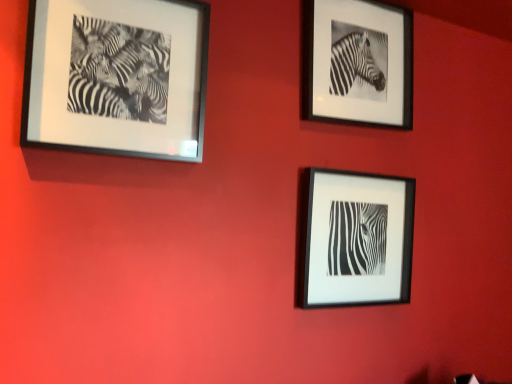
This screenshot has height=384, width=512. What are the coordinates of `black matte frame at upper right, the first picture frame from the right` in the screenshot? It's located at (357, 63).

What do you see at coordinates (355, 239) in the screenshot?
I see `black matte frame at center, which appears as the second picture frame when viewed from the right` at bounding box center [355, 239].

Find the location of a particular element. The width and height of the screenshot is (512, 384). black matte frame at upper right, the first picture frame from the right is located at coordinates (357, 63).

Can you tell me how much black matte frame at center, which appears as the second picture frame when viewed from the right, and black matte photo frame at upper left, the 3th picture frame positioned from the right, differ in facing direction?

The facing directions of black matte frame at center, which appears as the second picture frame when viewed from the right, and black matte photo frame at upper left, the 3th picture frame positioned from the right, are 0.181 degrees apart.

Is black matte frame at center, which appears as the second picture frame when viewed from the right, placed right next to black matte photo frame at upper left, which is the first picture frame from left to right?

No, black matte frame at center, which appears as the second picture frame when viewed from the right, is not next to black matte photo frame at upper left, which is the first picture frame from left to right.

Could you measure the distance between black matte frame at center, the 2th picture frame in the left-to-right sequence, and black matte photo frame at upper left, the 3th picture frame positioned from the right?

29.26 inches.

Which of these two, black matte frame at center, the 2th picture frame in the left-to-right sequence, or black matte photo frame at upper left, the 3th picture frame positioned from the right, is smaller?

black matte frame at center, the 2th picture frame in the left-to-right sequence, is smaller.

Which of these two, black matte photo frame at upper left, which is the first picture frame from left to right, or black matte frame at center, the 2th picture frame in the left-to-right sequence, is wider?

black matte photo frame at upper left, which is the first picture frame from left to right, is wider.

Is black matte photo frame at upper left, the 3th picture frame positioned from the right, closer to camera compared to black matte frame at center, which appears as the second picture frame when viewed from the right?

Yes, black matte photo frame at upper left, the 3th picture frame positioned from the right, is closer to the viewer.

Could you measure the distance between black matte photo frame at upper left, the 3th picture frame positioned from the right, and black matte frame at center, which appears as the second picture frame when viewed from the right?

black matte photo frame at upper left, the 3th picture frame positioned from the right, and black matte frame at center, which appears as the second picture frame when viewed from the right, are 74.31 centimeters apart.

Is black matte photo frame at upper left, which is the first picture frame from left to right, facing towards black matte frame at center, the 2th picture frame in the left-to-right sequence?

No, black matte photo frame at upper left, which is the first picture frame from left to right, is not oriented towards black matte frame at center, the 2th picture frame in the left-to-right sequence.

Where is `the 2nd picture frame in front of the black matte frame at upper right, which appears as the 3th picture frame when viewed from the left, counting from the anchor's position`? The width and height of the screenshot is (512, 384). the 2nd picture frame in front of the black matte frame at upper right, which appears as the 3th picture frame when viewed from the left, counting from the anchor's position is located at coordinates click(x=117, y=77).

Which is behind, black matte frame at upper right, which appears as the 3th picture frame when viewed from the left, or black matte photo frame at upper left, the 3th picture frame positioned from the right?

black matte frame at upper right, which appears as the 3th picture frame when viewed from the left, is more distant.

Between point (398, 62) and point (102, 112), which one is positioned behind?

Point (398, 62)

Looking at the image, does black matte frame at upper right, which appears as the 3th picture frame when viewed from the left, seem bigger or smaller compared to black matte photo frame at upper left, the 3th picture frame positioned from the right?

In the image, black matte frame at upper right, which appears as the 3th picture frame when viewed from the left, appears to be smaller than black matte photo frame at upper left, the 3th picture frame positioned from the right.

Does black matte frame at upper right, which appears as the 3th picture frame when viewed from the left, appear on the right side of black matte frame at center, the 2th picture frame in the left-to-right sequence?

Correct, you'll find black matte frame at upper right, which appears as the 3th picture frame when viewed from the left, to the right of black matte frame at center, the 2th picture frame in the left-to-right sequence.

Is black matte frame at upper right, which appears as the 3th picture frame when viewed from the left, wider or thinner than black matte frame at center, which appears as the second picture frame when viewed from the right?

In the image, black matte frame at upper right, which appears as the 3th picture frame when viewed from the left, appears to be more narrow than black matte frame at center, which appears as the second picture frame when viewed from the right.

Could you tell me if black matte frame at upper right, the first picture frame from the right, is facing black matte frame at center, which appears as the second picture frame when viewed from the right?

No, black matte frame at upper right, the first picture frame from the right, is not turned towards black matte frame at center, which appears as the second picture frame when viewed from the right.

From the image's perspective, between black matte frame at upper right, the first picture frame from the right, and black matte frame at center, which appears as the second picture frame when viewed from the right, who is located below?

black matte frame at center, which appears as the second picture frame when viewed from the right.

Are black matte frame at center, which appears as the second picture frame when viewed from the right, and black matte frame at upper right, which appears as the 3th picture frame when viewed from the left, far apart?

No.

From the image's perspective, which object appears higher, black matte frame at center, the 2th picture frame in the left-to-right sequence, or black matte frame at upper right, which appears as the 3th picture frame when viewed from the left?

black matte frame at upper right, which appears as the 3th picture frame when viewed from the left, is shown above in the image.

Can you confirm if black matte frame at center, the 2th picture frame in the left-to-right sequence, is positioned to the left of black matte frame at upper right, which appears as the 3th picture frame when viewed from the left?

Correct, you'll find black matte frame at center, the 2th picture frame in the left-to-right sequence, to the left of black matte frame at upper right, which appears as the 3th picture frame when viewed from the left.

From a real-world perspective, which picture frame is the 2nd one above the black matte frame at center, the 2th picture frame in the left-to-right sequence? Please provide its 2D coordinates.

[(357, 63)]

Is black matte photo frame at upper left, the 3th picture frame positioned from the right, taller than black matte frame at upper right, which appears as the 3th picture frame when viewed from the left?

In fact, black matte photo frame at upper left, the 3th picture frame positioned from the right, may be shorter than black matte frame at upper right, which appears as the 3th picture frame when viewed from the left.

Is black matte photo frame at upper left, the 3th picture frame positioned from the right, situated inside black matte frame at upper right, which appears as the 3th picture frame when viewed from the left, or outside?

The correct answer is: outside.

Is black matte photo frame at upper left, the 3th picture frame positioned from the right, wider than black matte frame at upper right, which appears as the 3th picture frame when viewed from the left?

Indeed, black matte photo frame at upper left, the 3th picture frame positioned from the right, has a greater width compared to black matte frame at upper right, which appears as the 3th picture frame when viewed from the left.

How much distance is there between black matte photo frame at upper left, which is the first picture frame from left to right, and black matte frame at upper right, the first picture frame from the right?

black matte photo frame at upper left, which is the first picture frame from left to right, is 26.87 inches from black matte frame at upper right, the first picture frame from the right.

Find the location of `picture frame that is in front of the black matte frame at center, the 2th picture frame in the left-to-right sequence`. picture frame that is in front of the black matte frame at center, the 2th picture frame in the left-to-right sequence is located at coordinates (117, 77).

This screenshot has height=384, width=512. What are the coordinates of `picture frame that is on the left side of black matte frame at center, which appears as the second picture frame when viewed from the right` in the screenshot? It's located at (117, 77).

Based on the photo, estimate the real-world distances between objects in this image. Which object is further from black matte frame at upper right, which appears as the 3th picture frame when viewed from the left, black matte photo frame at upper left, which is the first picture frame from left to right, or black matte frame at center, which appears as the second picture frame when viewed from the right?

black matte photo frame at upper left, which is the first picture frame from left to right, is positioned further to the anchor black matte frame at upper right, which appears as the 3th picture frame when viewed from the left.

From the image, which object appears to be nearer to black matte photo frame at upper left, the 3th picture frame positioned from the right, black matte frame at upper right, the first picture frame from the right, or black matte frame at center, the 2th picture frame in the left-to-right sequence?

black matte frame at upper right, the first picture frame from the right, lies closer to black matte photo frame at upper left, the 3th picture frame positioned from the right, than the other object.

When comparing their distances from black matte frame at upper right, which appears as the 3th picture frame when viewed from the left, does black matte frame at center, which appears as the second picture frame when viewed from the right, or black matte photo frame at upper left, the 3th picture frame positioned from the right, seem further?

black matte photo frame at upper left, the 3th picture frame positioned from the right, lies further to black matte frame at upper right, which appears as the 3th picture frame when viewed from the left, than the other object.

Estimate the real-world distances between objects in this image. Which object is further from black matte photo frame at upper left, the 3th picture frame positioned from the right, black matte frame at center, which appears as the second picture frame when viewed from the right, or black matte frame at upper right, which appears as the 3th picture frame when viewed from the left?

The object further to black matte photo frame at upper left, the 3th picture frame positioned from the right, is black matte frame at center, which appears as the second picture frame when viewed from the right.

Considering their positions, is black matte photo frame at upper left, the 3th picture frame positioned from the right, positioned further to black matte frame at center, which appears as the second picture frame when viewed from the right, than black matte frame at upper right, the first picture frame from the right?

black matte photo frame at upper left, the 3th picture frame positioned from the right, is further to black matte frame at center, which appears as the second picture frame when viewed from the right.

Looking at the image, which one is located closer to black matte frame at center, which appears as the second picture frame when viewed from the right, black matte frame at upper right, which appears as the 3th picture frame when viewed from the left, or black matte photo frame at upper left, which is the first picture frame from left to right?

Based on the image, black matte frame at upper right, which appears as the 3th picture frame when viewed from the left, appears to be nearer to black matte frame at center, which appears as the second picture frame when viewed from the right.

Locate an element on the screen. picture frame situated between black matte photo frame at upper left, which is the first picture frame from left to right, and black matte frame at upper right, which appears as the 3th picture frame when viewed from the left, from left to right is located at coordinates (355, 239).